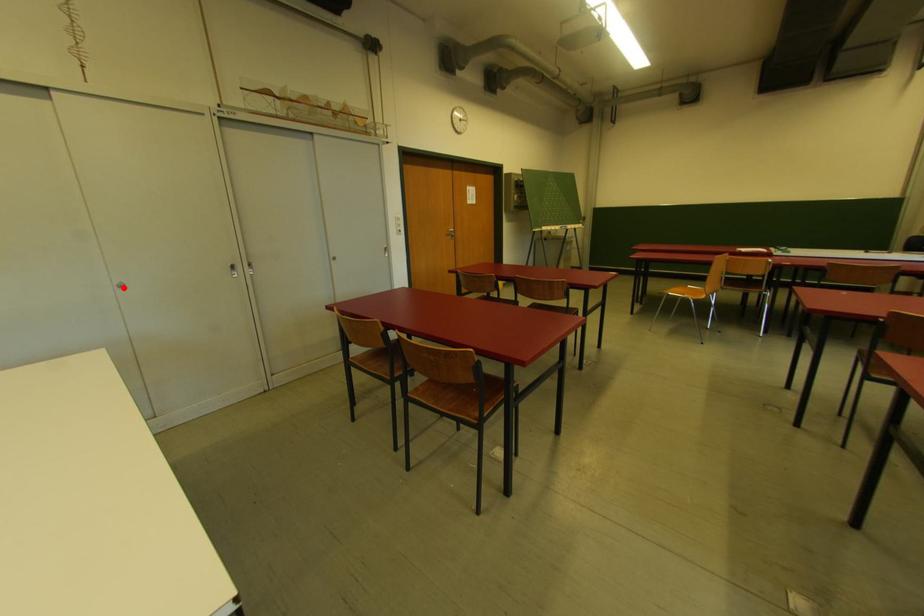
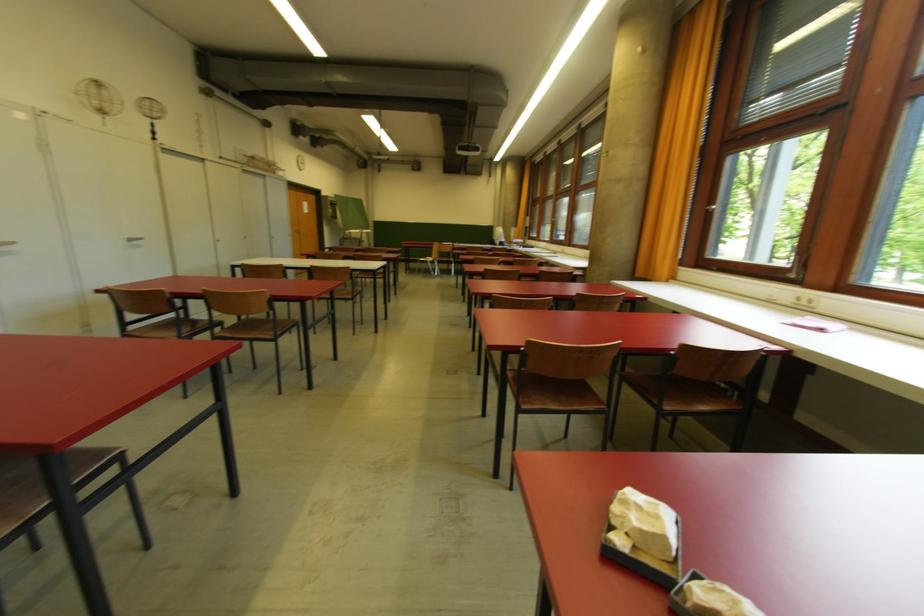
Question: I am providing you with two images of the same scene from different viewpoints. A red point is marked on the first image. Can you still see the location of the red point in image 2?

Choices:
 (A) Yes
 (B) No

Answer: (A)